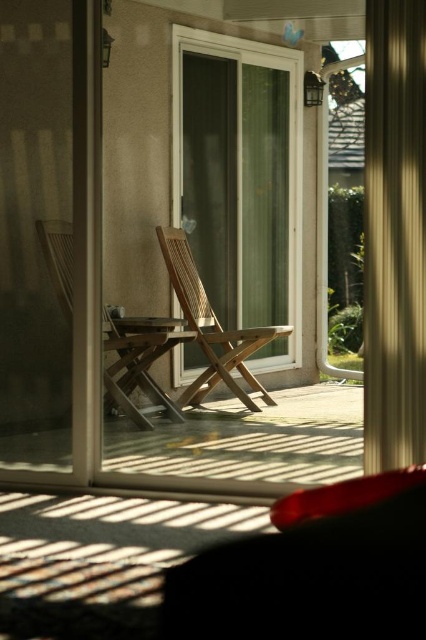
Question: Which point is farther from the camera taking this photo?

Choices:
 (A) (252, 90)
 (B) (414, 116)

Answer: (A)

Question: Estimate the real-world distances between objects in this image. Which object is farther from the natural wood chair at center?

Choices:
 (A) wooden chair at center
 (B) white wood door at center

Answer: (B)

Question: Can you confirm if white wood door at center is wider than beige fabric curtain at right?

Choices:
 (A) yes
 (B) no

Answer: (A)

Question: Can you confirm if beige fabric curtain at right is positioned to the left of wooden chair at center?

Choices:
 (A) yes
 (B) no

Answer: (B)

Question: Is white wood door at center above beige fabric curtain at right?

Choices:
 (A) yes
 (B) no

Answer: (A)

Question: Considering the real-world distances, which object is farthest from the white wood door at center?

Choices:
 (A) natural wood chair at center
 (B) wooden chair at center
 (C) beige fabric curtain at right

Answer: (B)